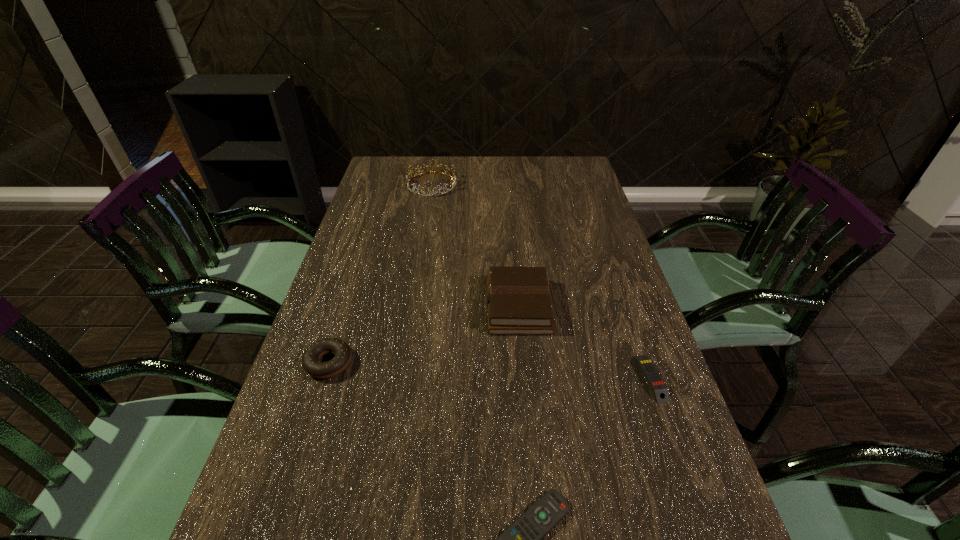
Identify the location of vacant space located on the spine side of the fourth nearest object. Image resolution: width=960 pixels, height=540 pixels. (380, 306).

In order to click on free space located on the front of the third tallest object in this screenshot , I will do [312, 414].

This screenshot has height=540, width=960. In order to click on vacant space located on the back of the rightmost object in this screenshot , I will do `click(622, 296)`.

Find the location of a particular element. The width and height of the screenshot is (960, 540). object that is at the far edge is located at coordinates (453, 181).

Where is `tiara located at the left edge`? This screenshot has height=540, width=960. tiara located at the left edge is located at coordinates (453, 181).

This screenshot has height=540, width=960. In order to click on doughnut that is at the left edge in this screenshot , I will do `click(310, 361)`.

At what (x,y) coordinates should I click in order to perform the action: click on object that is positioned at the right edge. Please return your answer as a coordinate pair (x, y). The height and width of the screenshot is (540, 960). Looking at the image, I should click on (657, 385).

Locate an element on the screen. The width and height of the screenshot is (960, 540). object that is at the far left corner is located at coordinates (453, 181).

Identify the location of free space at the far edge of the desktop. (499, 174).

I want to click on free location at the left edge of the desktop, so click(x=348, y=300).